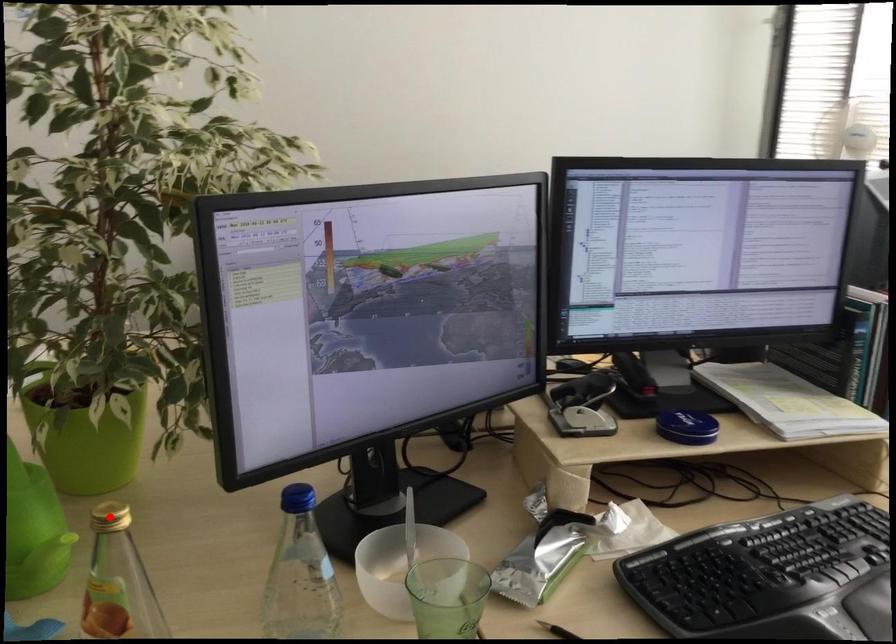
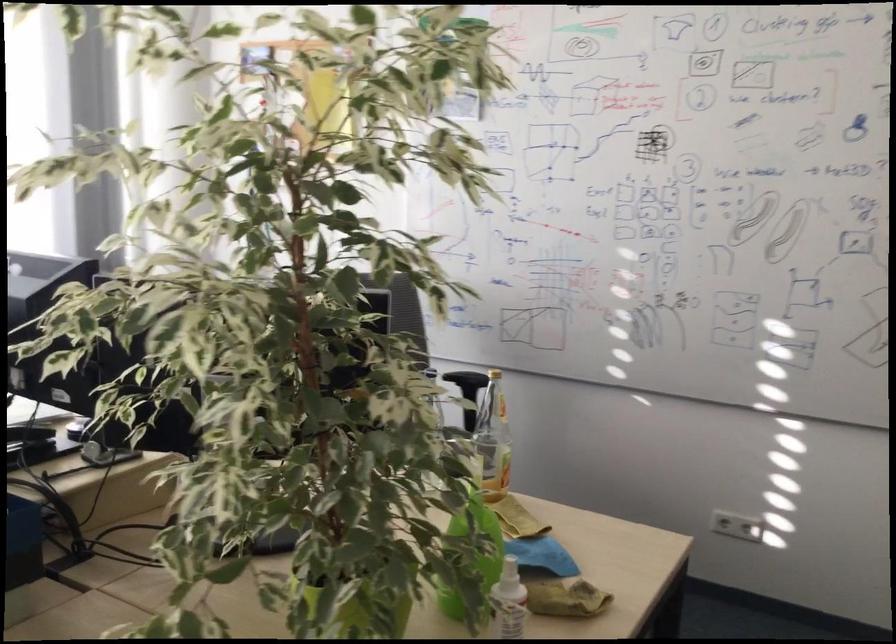
Question: I am providing you with two images of the same scene from different viewpoints. A red point is marked on the first image. At the location where the point appears in image 1, is it still visible in image 2?

Choices:
 (A) Yes
 (B) No

Answer: (B)